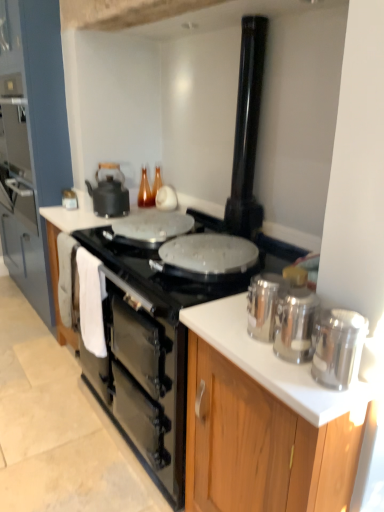
The width and height of the screenshot is (384, 512). What are the coordinates of `vacant area that is in front of silver metallic canisters at right, which is the 2th kitchen appliance from top to bottom` in the screenshot? It's located at (272, 367).